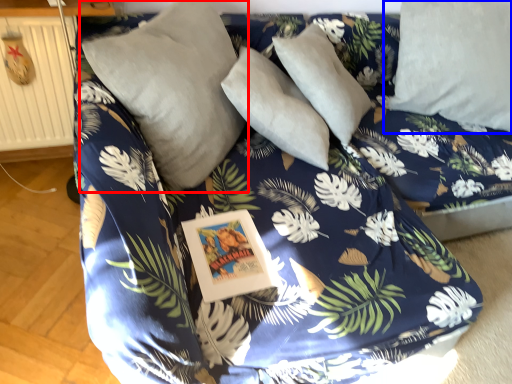
Question: Among these objects, which one is nearest to the camera, pillow (highlighted by a red box) or pillow (highlighted by a blue box)?

Choices:
 (A) pillow
 (B) pillow

Answer: (A)